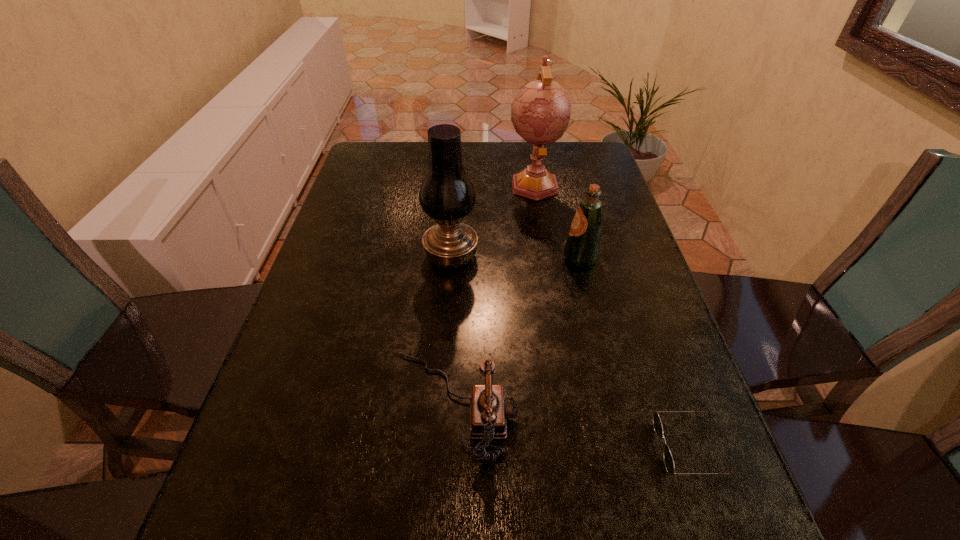
The width and height of the screenshot is (960, 540). What are the coordinates of `vacant space at the right edge` in the screenshot? It's located at (632, 255).

I want to click on vacant space at the far left corner of the desktop, so click(365, 160).

Where is `vacant space in between the oil lamp and the third tallest object`? The width and height of the screenshot is (960, 540). vacant space in between the oil lamp and the third tallest object is located at coordinates (516, 257).

Find the location of a particular element. free area in between the second shortest object and the globe is located at coordinates (494, 295).

Identify the location of empty location between the olive oil and the fourth tallest object. (517, 332).

Image resolution: width=960 pixels, height=540 pixels. In order to click on vacant area that lies between the third shortest object and the fourth tallest object in this screenshot , I will do `click(517, 332)`.

Identify the location of vacant region between the sunglasses and the telephone. The image size is (960, 540). (572, 426).

I want to click on vacant area between the globe and the olive oil, so click(558, 221).

At what (x,y) coordinates should I click in order to perform the action: click on free space between the rightmost object and the oil lamp. Please return your answer as a coordinate pair (x, y). The width and height of the screenshot is (960, 540). Looking at the image, I should click on (571, 352).

You are a GUI agent. You are given a task and a screenshot of the screen. Output one action in this format:
    pyautogui.click(x=<x>, y=<y>)
    Task: Click on the free area in between the globe and the fourth tallest object
    
    Given the screenshot: What is the action you would take?
    pyautogui.click(x=494, y=295)